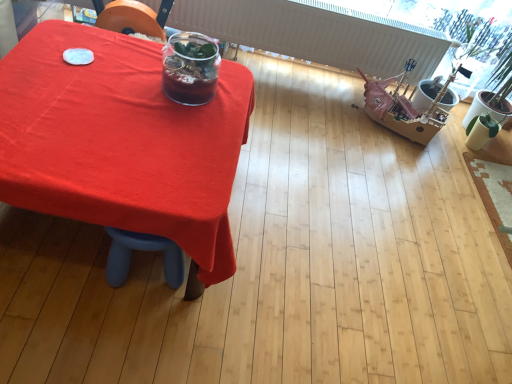
Where is `blank area to the left of translucent glass jar at center`? Image resolution: width=512 pixels, height=384 pixels. blank area to the left of translucent glass jar at center is located at coordinates (133, 72).